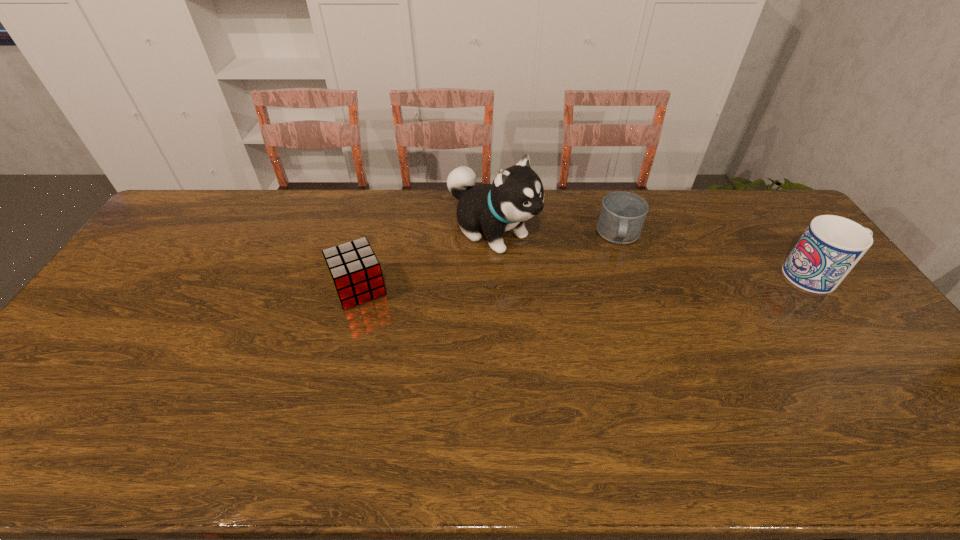
I want to click on vacant space that is in between the second object from right to left and the puppy, so click(556, 233).

Find the location of a particular element. The height and width of the screenshot is (540, 960). vacant space that is in between the farther mug and the leftmost object is located at coordinates (490, 262).

Where is `vacant area that lies between the shorter mug and the third shortest object`? vacant area that lies between the shorter mug and the third shortest object is located at coordinates (720, 256).

This screenshot has width=960, height=540. I want to click on vacant area between the leftmost object and the third shortest object, so click(589, 282).

Locate an element on the screen. The height and width of the screenshot is (540, 960). unoccupied position between the taller mug and the tallest object is located at coordinates (656, 253).

Find the location of a particular element. The image size is (960, 540). object that ranks as the second closest to the puppy is located at coordinates (622, 215).

This screenshot has width=960, height=540. Find the location of `object that is the closest to the puppy`. object that is the closest to the puppy is located at coordinates (354, 269).

Identify the location of free location that satisfies the following two spatial constraints: 1. on the back side of the puppy; 2. on the left side of the leftmost object. The height and width of the screenshot is (540, 960). (374, 231).

Find the location of a particular element. vacant space that satisfies the following two spatial constraints: 1. on the back side of the cube; 2. on the right side of the shorter mug is located at coordinates (372, 236).

The width and height of the screenshot is (960, 540). Identify the location of vacant space that satisfies the following two spatial constraints: 1. on the back side of the shorter mug; 2. on the right side of the leftmost object. (372, 236).